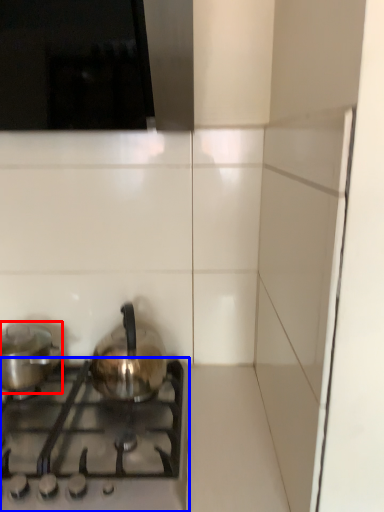
Question: Which object appears closest to the camera in this image, kitchen appliance (highlighted by a red box) or gas stove (highlighted by a blue box)?

Choices:
 (A) kitchen appliance
 (B) gas stove

Answer: (B)